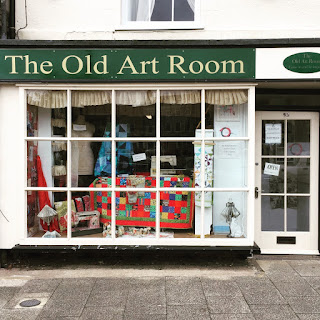
Where is `valance`? The image size is (320, 320). valance is located at coordinates (48, 102).